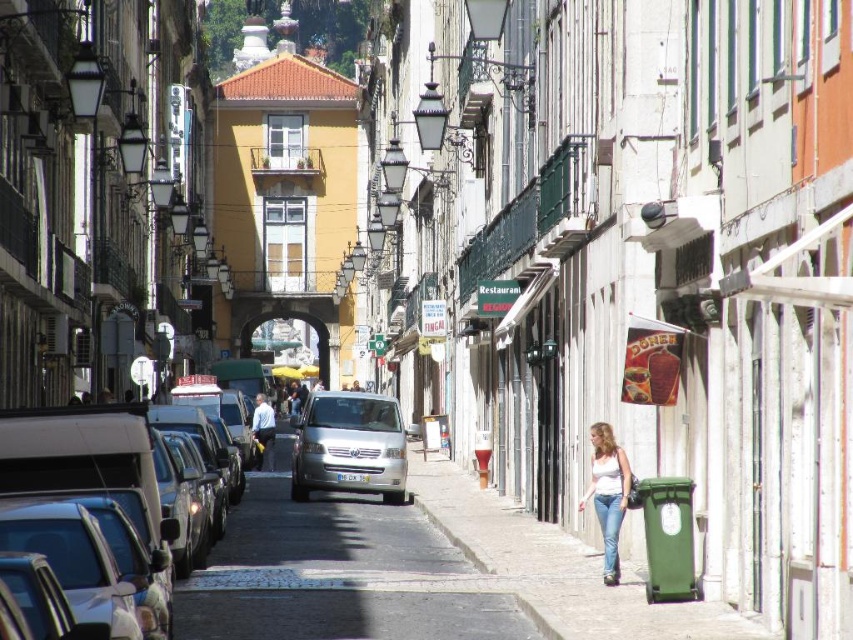
Which is above, shiny silver van at center-left or denim jeans at lower right?

shiny silver van at center-left is above.

Is point (3, 458) positioned behind point (610, 547)?

No, (3, 458) is closer to viewer.

Find the location of `shiny silver van at center-left`. shiny silver van at center-left is located at coordinates (96, 467).

Locate an element on the screen. The height and width of the screenshot is (640, 853). shiny silver van at center-left is located at coordinates (96, 467).

Who is more forward, (155, 460) or (355, 424)?

Point (155, 460)

Looking at this image, does shiny silver van at center-left have a greater width compared to silver metallic van at center?

No.

Measure the distance between shiny silver van at center-left and camera.

36.01 meters

Find the location of `shiny silver van at center-left`. shiny silver van at center-left is located at coordinates (96, 467).

Is silver metallic van at center shorter than denim jeans at lower right?

Incorrect, silver metallic van at center's height does not fall short of denim jeans at lower right's.

Where is `silver metallic van at center`? This screenshot has height=640, width=853. silver metallic van at center is located at coordinates (350, 445).